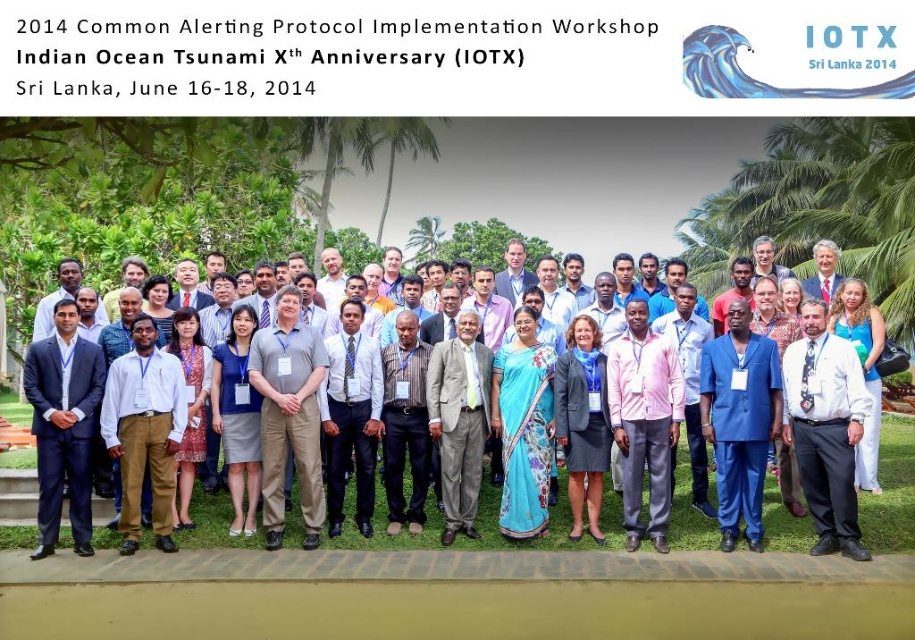
Consider the image. Can you confirm if matte khaki pants at center is taller than gray wool suit at center?

In fact, matte khaki pants at center may be shorter than gray wool suit at center.

Is point (154, 428) farther from camera compared to point (483, 348)?

No, (154, 428) is closer to viewer.

Find the location of a particular element. matte khaki pants at center is located at coordinates (144, 429).

The image size is (915, 640). In order to click on matte khaki pants at center in this screenshot , I will do `click(144, 429)`.

Who is more distant from viewer, (47, 538) or (332, 396)?

Positioned behind is point (332, 396).

Where is `dark blue suit at center`? Image resolution: width=915 pixels, height=640 pixels. dark blue suit at center is located at coordinates (63, 426).

Who is more forward, (61, 467) or (362, 305)?

Point (61, 467) is in front.

Find the location of `dark blue suit at center`. dark blue suit at center is located at coordinates (63, 426).

Is dark blue suit at center positioned before matte khaki pants at center?

Yes, it is in front of matte khaki pants at center.

Is dark blue suit at center wider than matte khaki pants at center?

Indeed, dark blue suit at center has a greater width compared to matte khaki pants at center.

Find the location of a particular element. The width and height of the screenshot is (915, 640). dark blue suit at center is located at coordinates (63, 426).

What are the coordinates of `dark blue suit at center` in the screenshot? It's located at (63, 426).